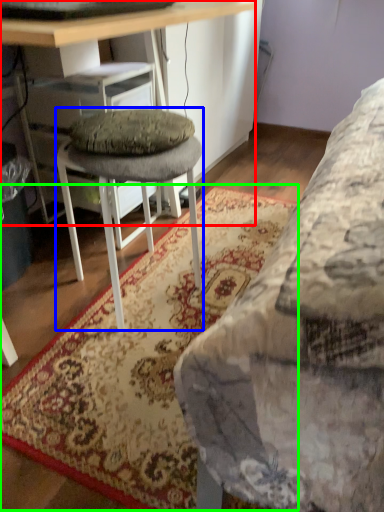
Question: Considering the real-world distances, which object is closest to desk (highlighted by a red box)? stool (highlighted by a blue box) or mat (highlighted by a green box).

Choices:
 (A) stool
 (B) mat

Answer: (A)